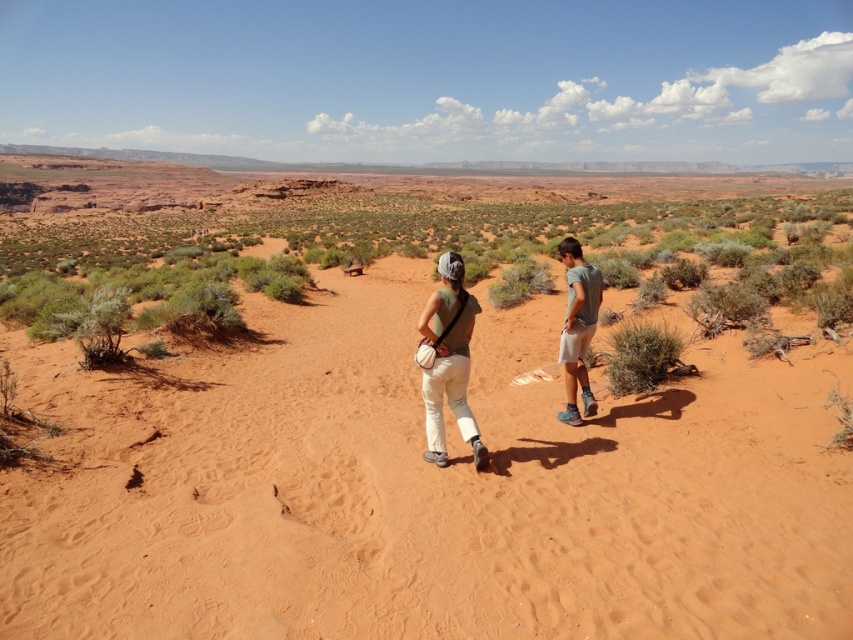
Question: Which point is closer to the camera taking this photo?

Choices:
 (A) (563, 257)
 (B) (451, 291)
 (C) (384, 419)

Answer: (B)

Question: Is dusty sand at center to the left of green shrub at center from the viewer's perspective?

Choices:
 (A) yes
 (B) no

Answer: (A)

Question: Which of the following is the closest to the observer?

Choices:
 (A) coord(618,355)
 (B) coord(460,410)
 (C) coord(280,408)
 (D) coord(425,368)

Answer: (D)

Question: Which object appears closest to the camera in this image?

Choices:
 (A) dusty sand at center
 (B) white cotton shorts at right
 (C) matte green tank top at center

Answer: (A)

Question: Can you confirm if white cotton pants at center is positioned to the left of matte green tank top at center?

Choices:
 (A) no
 (B) yes

Answer: (B)

Question: Is dusty sand at center to the right of green shrub at center from the viewer's perspective?

Choices:
 (A) no
 (B) yes

Answer: (A)